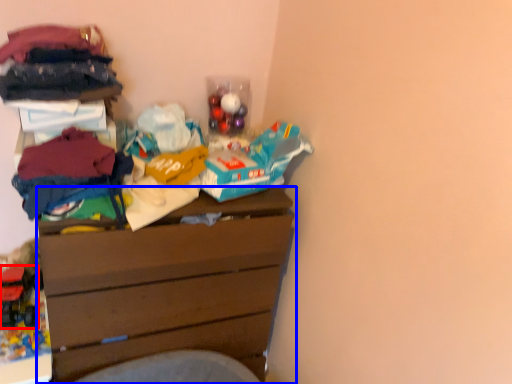
Question: Which object is closer to the camera taking this photo, toy (highlighted by a red box) or chest of drawers (highlighted by a blue box)?

Choices:
 (A) toy
 (B) chest of drawers

Answer: (B)